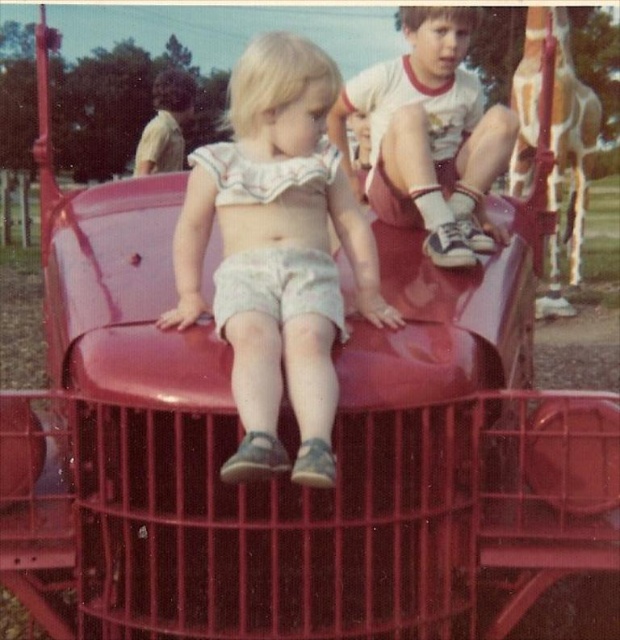
Question: Which object is closer to the camera taking this photo?

Choices:
 (A) matte white shorts at center
 (B) white cotton shirt at upper right

Answer: (A)

Question: Does matte white shorts at center appear on the right side of white cotton shirt at upper right?

Choices:
 (A) no
 (B) yes

Answer: (A)

Question: In this image, where is matte white shorts at center located relative to white cotton shirt at upper right?

Choices:
 (A) right
 (B) left

Answer: (B)

Question: Which point is closer to the camera?

Choices:
 (A) (330, 218)
 (B) (394, 92)

Answer: (A)

Question: Is matte white shorts at center above white cotton shirt at upper right?

Choices:
 (A) no
 (B) yes

Answer: (A)